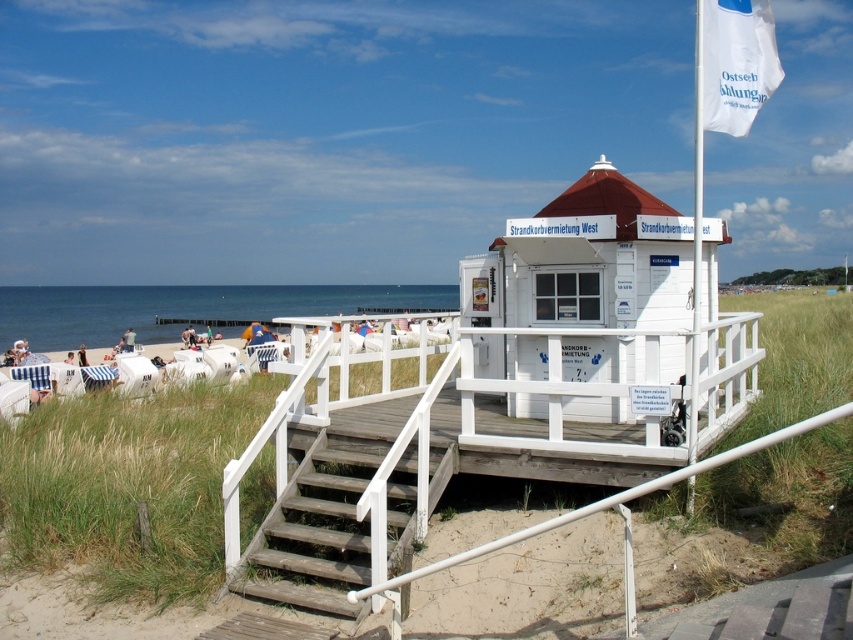
Question: Which of these objects is positioned farthest from the white wooden beach hut at center?

Choices:
 (A) wooden stairs at center
 (B) white fabric flag at upper right

Answer: (A)

Question: Can you confirm if white wooden beach hut at center is thinner than white fabric flag at upper right?

Choices:
 (A) yes
 (B) no

Answer: (B)

Question: Does white wooden beach hut at center have a smaller size compared to wooden stairs at center?

Choices:
 (A) no
 (B) yes

Answer: (A)

Question: Estimate the real-world distances between objects in this image. Which object is closer to the white wooden beach hut at center?

Choices:
 (A) white fabric flag at upper right
 (B) wooden stairs at center

Answer: (A)

Question: Is white wooden beach hut at center to the left of white fabric flag at upper right from the viewer's perspective?

Choices:
 (A) no
 (B) yes

Answer: (B)

Question: Which object is the closest to the white wooden beach hut at center?

Choices:
 (A) wooden stairs at center
 (B) white fabric flag at upper right

Answer: (B)